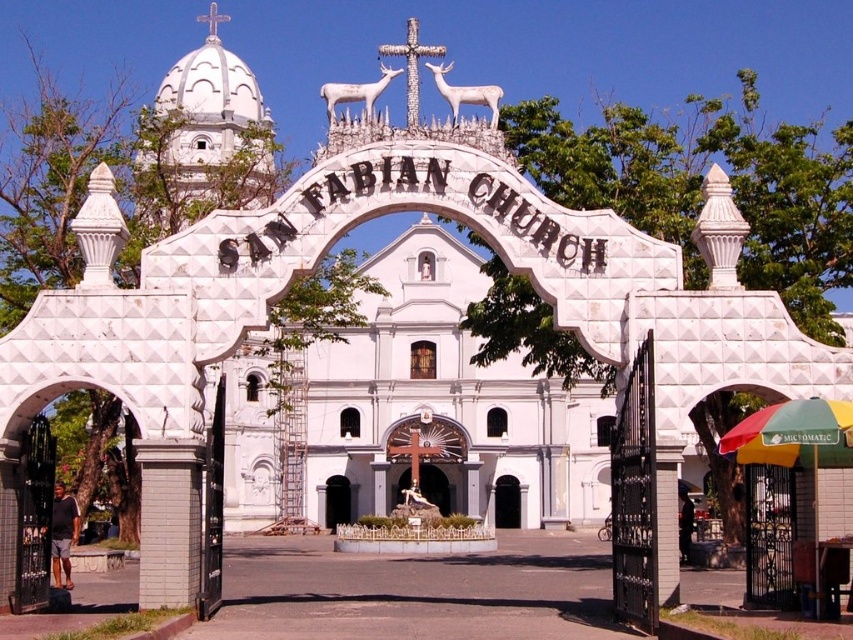
You are a delivery person trying to enter the San Fabian Church with a large wooden crate that is 1.5 meters wide. The crate must pass through either the black matte door at center or the white stone archway at center. Based on their sizes, which one should you choose?

The black matte door at center has a larger width than the white stone archway at center, so you should choose the black matte door at center to pass through with the large wooden crate that is 1.5 meters wide.

You are standing at the entrance of the San Fabian Church and want to take a photo of the white matte deer at upper center. Considering your camera has a maximum focus range of 150 feet, will you be able to capture a clear image of the deer?

The white matte deer at upper center is 149.62 feet away from the viewer. Since the camera can focus up to 150 feet, it is within range, so yes, you can capture a clear image of the deer.

You are standing at the entrance of San Fabian Church and want to open the black matte door at center. However, you notice the white matte deer at center blocking your path. Can you still reach the door without moving the deer?

The white matte deer at center is in front of the black matte door at center, so you cannot reach the door without moving the deer.